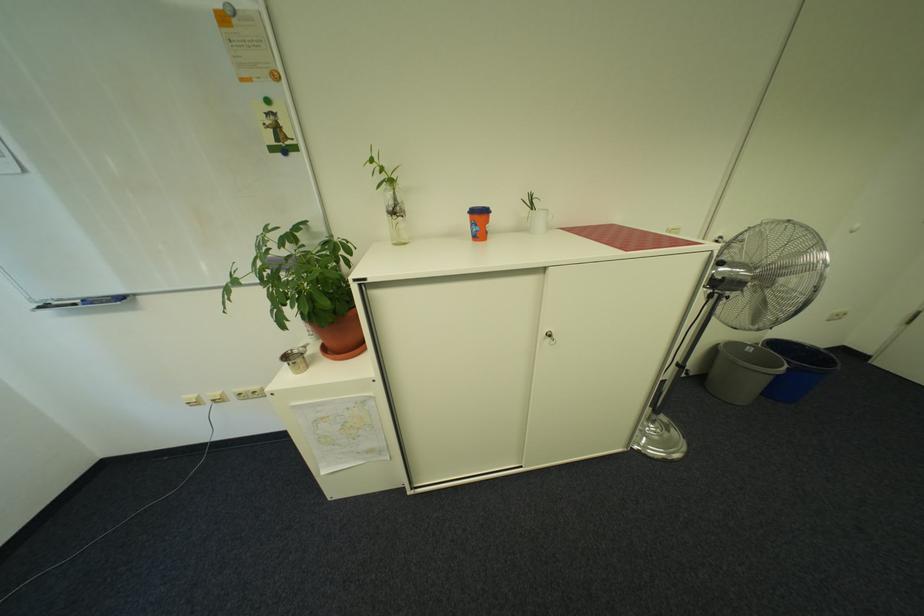
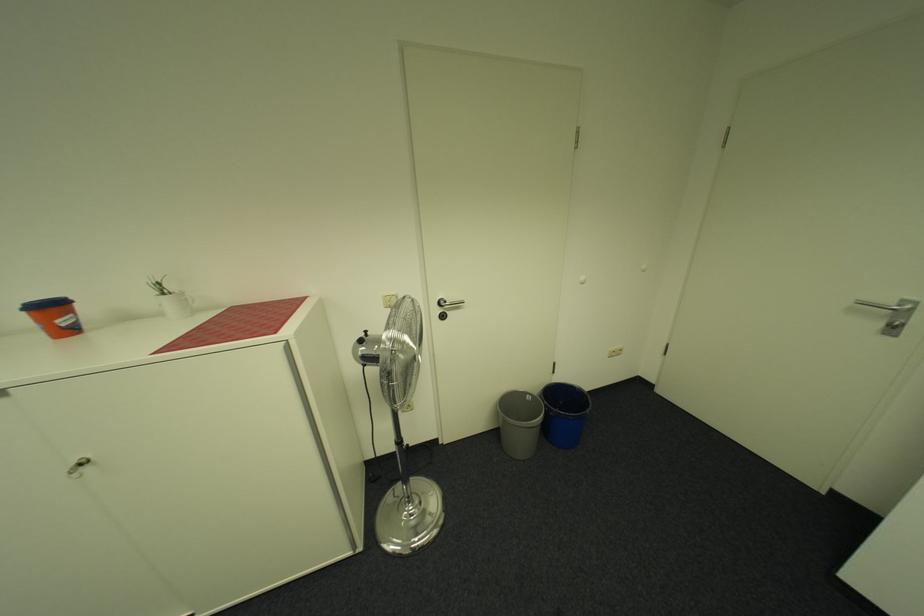
Locate, in the second image, the point that corresponds to the point at 799,361 in the first image.

(562, 408)